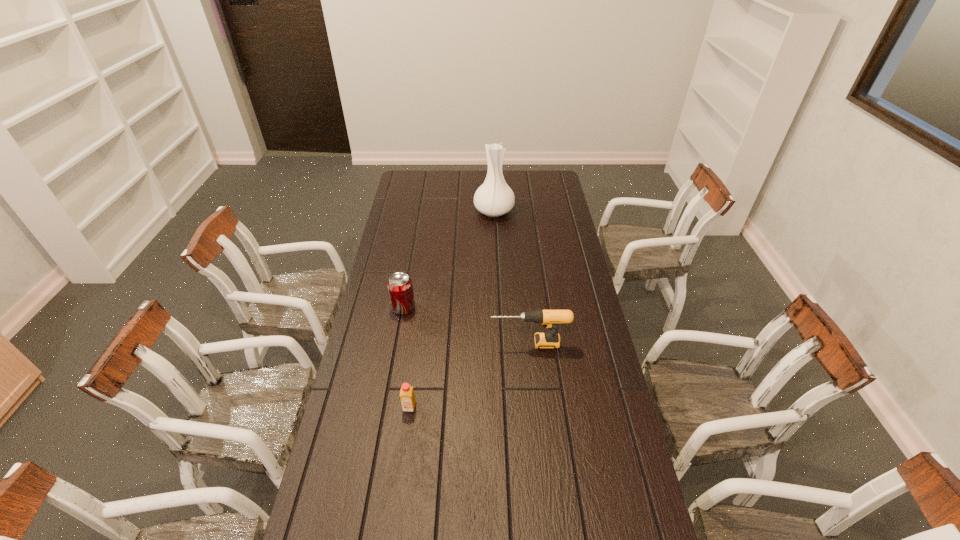
Locate an element on the screen. vacant area that lies between the nearest object and the leftmost object is located at coordinates (406, 357).

Where is `free spot between the farthest object and the second object from left to right`? The width and height of the screenshot is (960, 540). free spot between the farthest object and the second object from left to right is located at coordinates (451, 309).

You are a GUI agent. You are given a task and a screenshot of the screen. Output one action in this format:
    pyautogui.click(x=<x>, y=<y>)
    Task: Click on the unoccupied area between the soda can and the vase
    
    Given the screenshot: What is the action you would take?
    pyautogui.click(x=448, y=259)

At what (x,y) coordinates should I click in order to perform the action: click on blank region between the tallest object and the third farthest object. Please return your answer as a coordinate pair (x, y). This screenshot has width=960, height=540. Looking at the image, I should click on (512, 277).

Where is `free area in between the farthest object and the soda can`? free area in between the farthest object and the soda can is located at coordinates (448, 259).

Where is `vacant space in between the vase and the drill`? vacant space in between the vase and the drill is located at coordinates (512, 277).

Image resolution: width=960 pixels, height=540 pixels. I want to click on vacant point located between the vase and the nearest object, so click(451, 309).

Identify the location of free space between the vase and the leftmost object. (448, 259).

Select which object appears as the second closest to the vase. Please provide its 2D coordinates. Your answer should be formatted as a tuple, i.e. [(x, y)], where the tuple contains the x and y coordinates of a point satisfying the conditions above.

[(549, 318)]

The image size is (960, 540). Find the location of `the closest object to the second nearest object`. the closest object to the second nearest object is located at coordinates (400, 288).